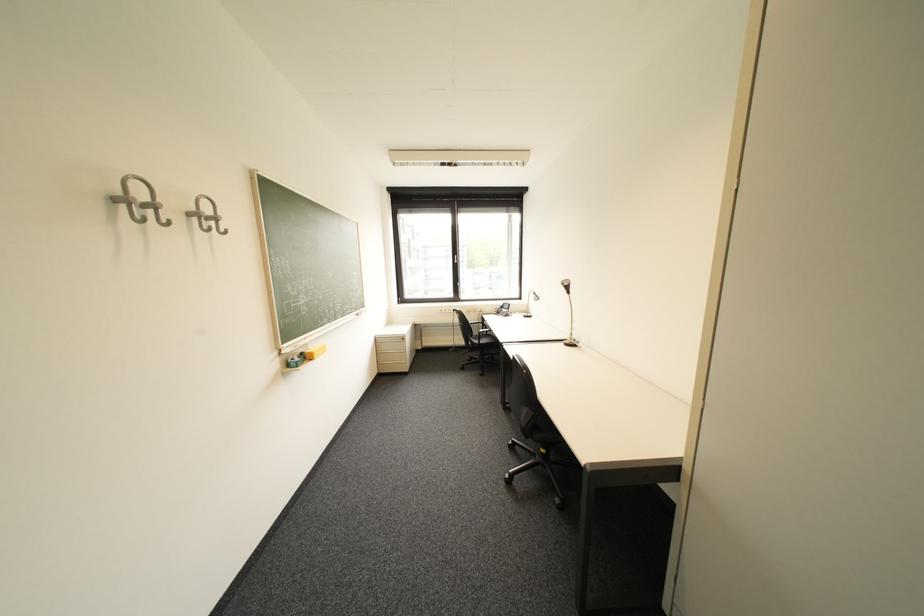
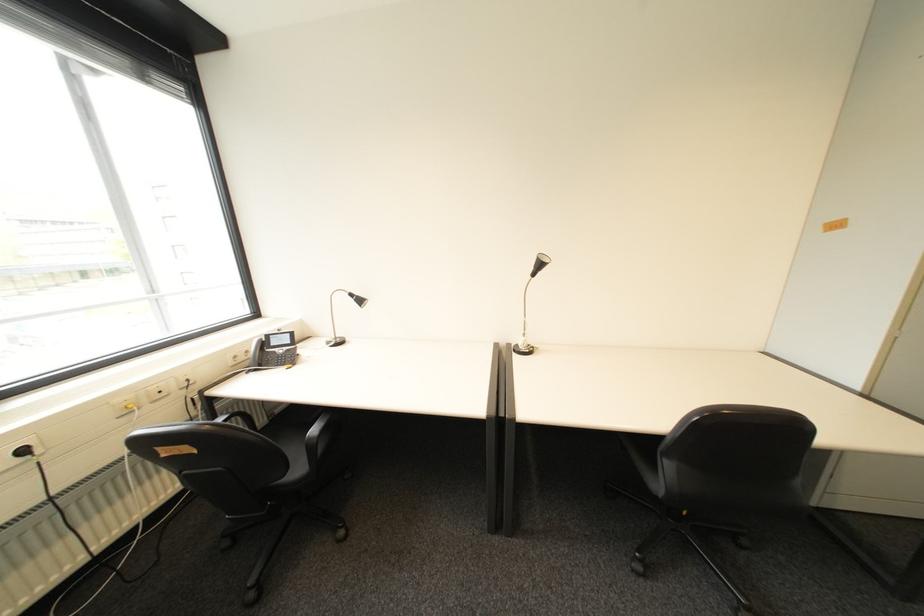
Question: I am providing you with two images of the same scene from different viewpoints. After the viewpoint changes to image2, which objects are now occluded?

Choices:
 (A) white power outlet
 (B) black power plug
 (C) metal coat rack hook
 (D) chair armrest

Answer: (D)